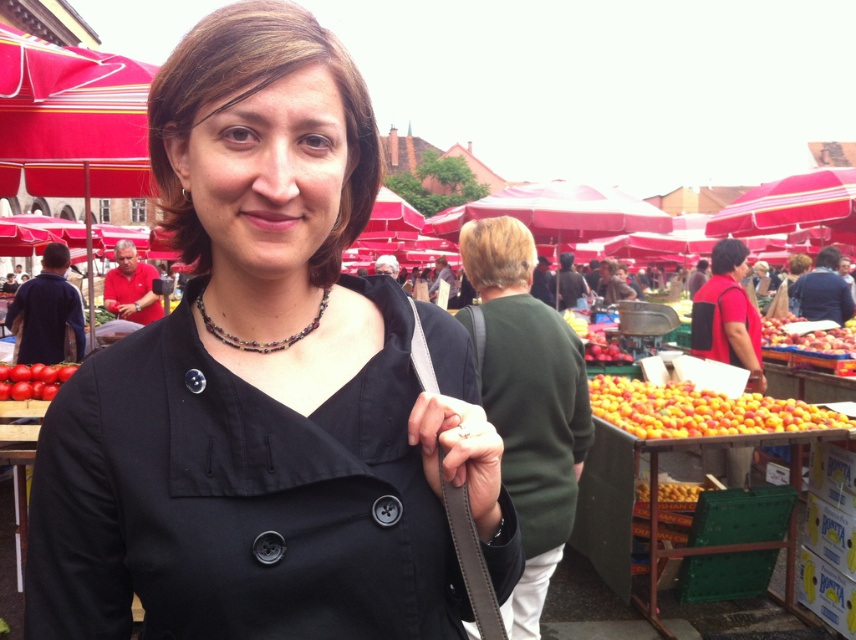
You are a vendor at the market and want to place a new item between the green matte sweater at center and the shiny red tomato at lower left. Considering their sizes, which item should you place closer to the tomato to ensure there is enough space?

The green matte sweater at center is wider than the shiny red tomato at lower left, so placing the new item closer to the tomato would leave more space between the two existing items.

You are a customer at the market and want to pick up the shiny red tomato at lower left. Is the green matte sweater at center blocking your direct path to it?

The green matte sweater at center is in front of the shiny red tomato at lower left, so yes, the green matte sweater at center is blocking the direct path to the shiny red tomato at lower left.

Based on the photo, you are a vendor at the market and want to place a new sign above the shiny red tomato at lower left. The sign you have is the same height as the green matte sweater at center. Will the sign be taller than the tomato?

The green matte sweater at center is much taller than the shiny red tomato at lower left. Since the sign has the same height as the sweater, the sign will indeed be taller than the tomato.